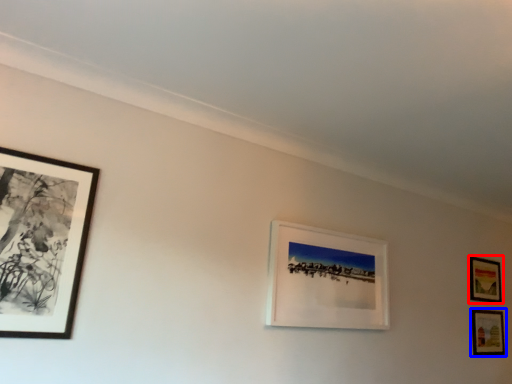
Question: Which point is closer to the camera, picture frame (highlighted by a red box) or picture frame (highlighted by a blue box)?

Choices:
 (A) picture frame
 (B) picture frame

Answer: (B)